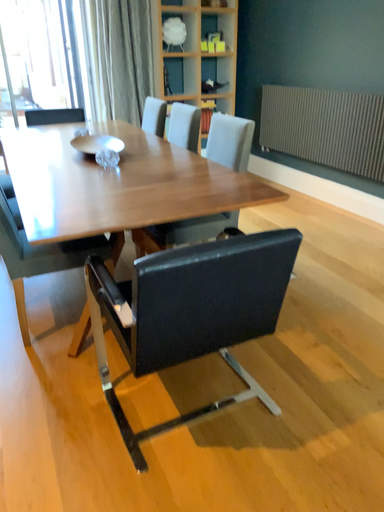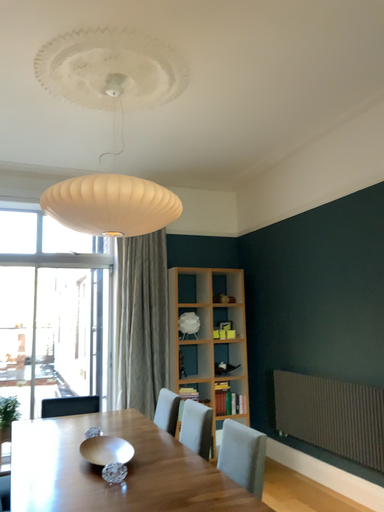
Question: Which way did the camera rotate in the video?

Choices:
 (A) rotated upward
 (B) rotated downward

Answer: (A)